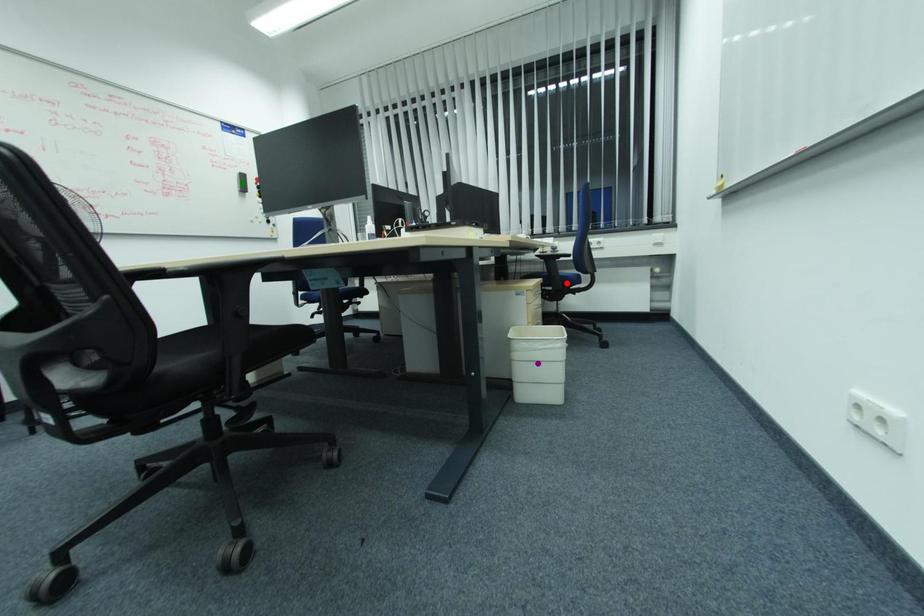
Order these from nearest to farthest:
A) green point
B) red point
C) purple point

purple point, red point, green point